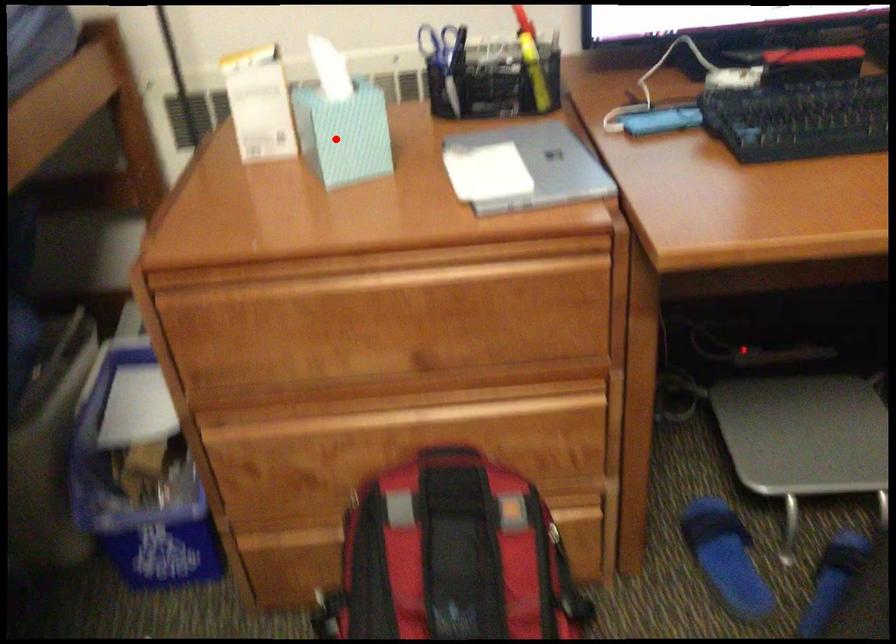
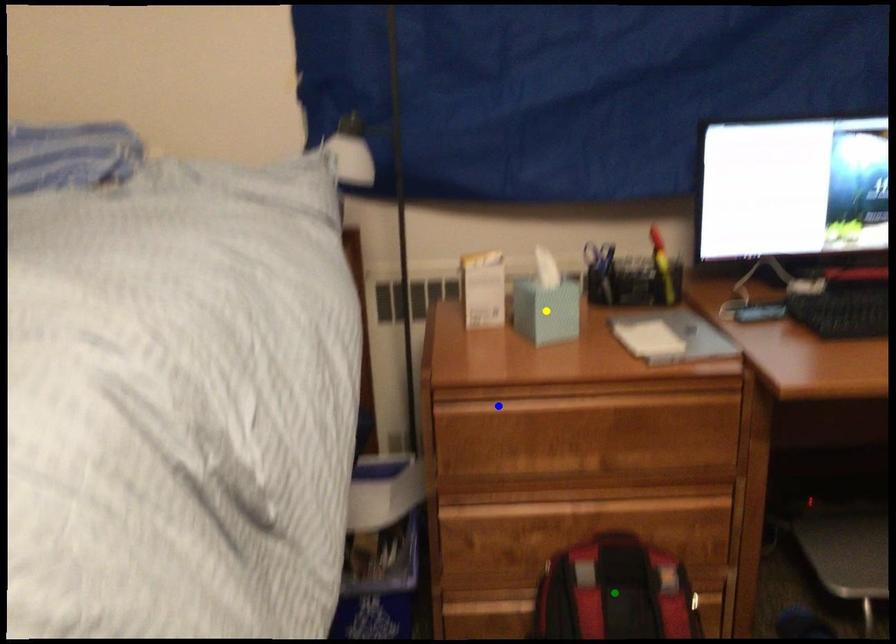
Question: I am providing you with two images of the same scene from different viewpoints. A red point is marked on the first image. You are given multiple points on the second image. Which point in image 2 is actually the same real-world point as the red point in image 1?

Choices:
 (A) green point
 (B) blue point
 (C) yellow point

Answer: (C)